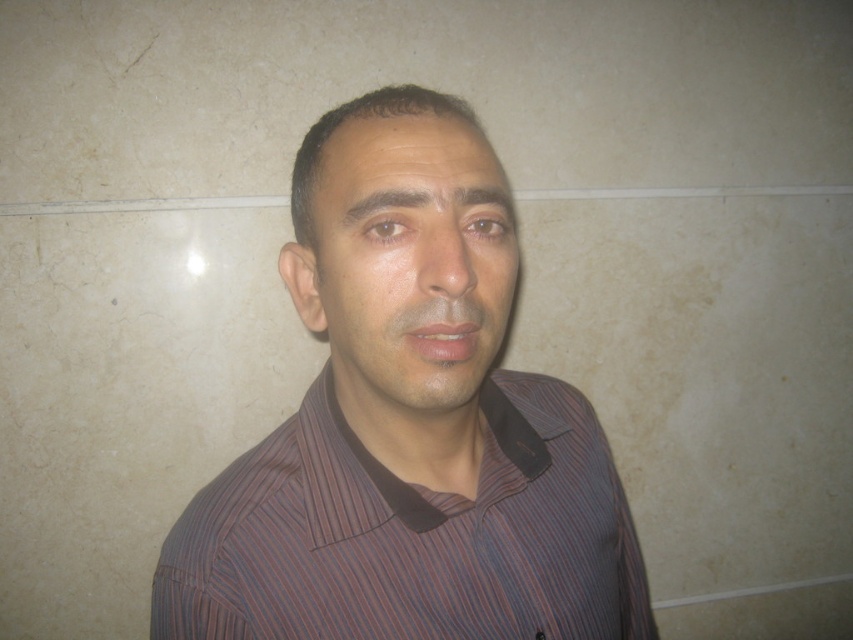
You are an interior designer analyzing the placement of the striped shirt at center in the image. Based on its coordinates, is it closer to the top or bottom half of the frame?

The striped shirt at center is positioned at coordinates point (408, 424). Since the y coordinate is 0.479, which is below 0.5, it is closer to the bottom half of the frame.

You are a photographer setting up a portrait session. You notice the striped cotton shirt at center and the smooth skin face at center in the frame. Based on their sizes, which one would you adjust your camera focus on to ensure the subject is prominent? Please explain your reasoning.

The striped cotton shirt at center has a larger size compared to the smooth skin face at center. To ensure the subject is prominent, you should focus on the striped cotton shirt at center since it occupies more space in the frame, making it the dominant element.

You are an architect analyzing the wall in the image. You have two points marked on the wall at coordinates point [474,333] and point [517,262]. Which of these points is positioned closer to the viewer?

Point [474,333] is closer to the viewer than point [517,262].